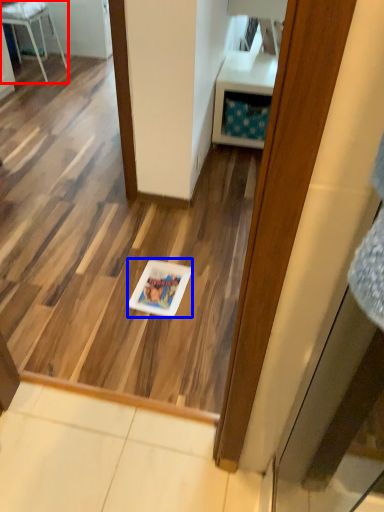
Question: Which object appears farthest to the camera in this image, furniture (highlighted by a red box) or glass plate (highlighted by a blue box)?

Choices:
 (A) furniture
 (B) glass plate

Answer: (A)